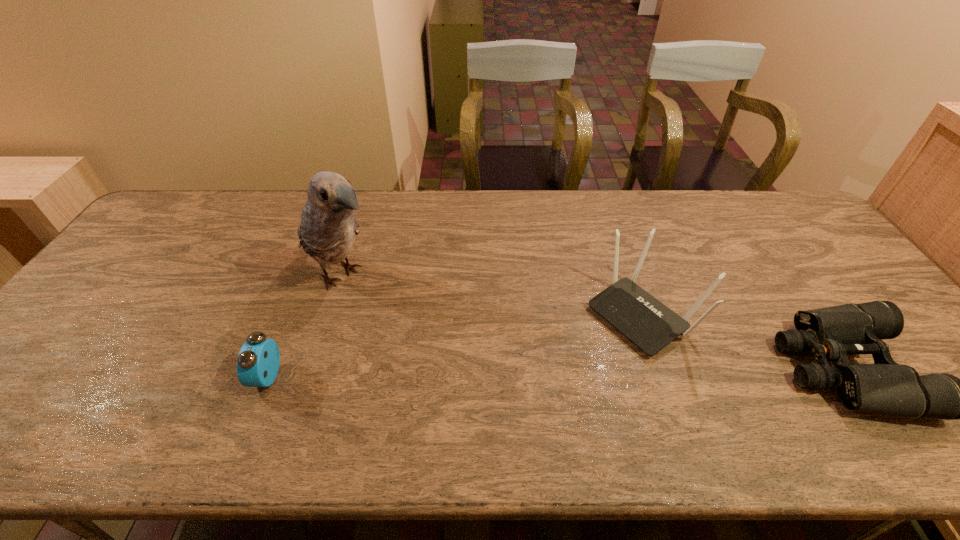
Identify the location of vacant space located through the eyepieces of the shortest object. (646, 368).

This screenshot has height=540, width=960. What are the coordinates of `vacant region located 0.220m through the eyepieces of the shortest object` in the screenshot? It's located at (692, 368).

This screenshot has height=540, width=960. What are the coordinates of `vacant point located on the front-facing side of the parrot` in the screenshot? It's located at (440, 342).

What are the coordinates of `free space located on the front-facing side of the parrot` in the screenshot? It's located at (396, 311).

At what (x,y) coordinates should I click in order to perform the action: click on free location located 0.190m on the front-facing side of the parrot. Please return your answer as a coordinate pair (x, y). Image resolution: width=960 pixels, height=540 pixels. Looking at the image, I should click on (420, 328).

Where is `vacant space located on the front-facing side of the third object from left to right`? vacant space located on the front-facing side of the third object from left to right is located at coordinates (577, 360).

This screenshot has height=540, width=960. What are the coordinates of `free spot located 0.270m on the front-facing side of the third object from left to right` in the screenshot? It's located at (522, 396).

Find the location of a particular element. The image size is (960, 540). vacant space situated 0.160m on the front-facing side of the third object from left to right is located at coordinates (559, 372).

The width and height of the screenshot is (960, 540). I want to click on alarm clock at the near edge, so click(x=258, y=362).

In order to click on binoculars situated at the near edge in this screenshot , I will do `click(832, 333)`.